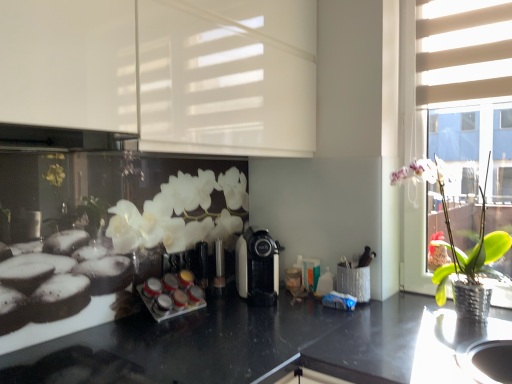
Question: Considering the relative sizes of green leafy plant in metallic pot at right and white glossy cabinet at upper left, acting as the first shutter starting from the left, in the image provided, is green leafy plant in metallic pot at right wider than white glossy cabinet at upper left, acting as the first shutter starting from the left,?

Choices:
 (A) no
 (B) yes

Answer: (A)

Question: Is green leafy plant in metallic pot at right behind white glossy cabinet at upper left, acting as the first shutter starting from the left?

Choices:
 (A) yes
 (B) no

Answer: (A)

Question: From a real-world perspective, is green leafy plant in metallic pot at right on white glossy cabinet at upper left, acting as the first shutter starting from the left?

Choices:
 (A) no
 (B) yes

Answer: (A)

Question: Is green leafy plant in metallic pot at right at the left side of white glossy cabinet at upper left, positioned as the second shutter in right-to-left order?

Choices:
 (A) no
 (B) yes

Answer: (A)

Question: Considering the relative sizes of green leafy plant in metallic pot at right and white glossy cabinet at upper left, acting as the first shutter starting from the left, in the image provided, is green leafy plant in metallic pot at right shorter than white glossy cabinet at upper left, acting as the first shutter starting from the left,?

Choices:
 (A) no
 (B) yes

Answer: (B)

Question: Looking at their shapes, would you say white glossy spice rack at center is wider or thinner than beige fabric blinds at upper right, which is the 2th shutter from left to right?

Choices:
 (A) thin
 (B) wide

Answer: (B)

Question: From their relative heights in the image, would you say white glossy spice rack at center is taller or shorter than beige fabric blinds at upper right, the 1th shutter positioned from the right?

Choices:
 (A) short
 (B) tall

Answer: (A)

Question: From the image's perspective, is white glossy spice rack at center above or below beige fabric blinds at upper right, which is the 2th shutter from left to right?

Choices:
 (A) below
 (B) above

Answer: (A)

Question: Considering their positions, is white glossy spice rack at center located in front of or behind beige fabric blinds at upper right, the 1th shutter positioned from the right?

Choices:
 (A) behind
 (B) front

Answer: (B)

Question: Is black plastic coffee machine at center bigger or smaller than beige fabric blinds at upper right, which is the 2th shutter from left to right?

Choices:
 (A) small
 (B) big

Answer: (B)

Question: From the image's perspective, relative to beige fabric blinds at upper right, the 1th shutter positioned from the right, is black plastic coffee machine at center above or below?

Choices:
 (A) below
 (B) above

Answer: (A)

Question: Is black plastic coffee machine at center wider or thinner than beige fabric blinds at upper right, which is the 2th shutter from left to right?

Choices:
 (A) wide
 (B) thin

Answer: (A)

Question: Is black plastic coffee machine at center in front of or behind beige fabric blinds at upper right, which is the 2th shutter from left to right, in the image?

Choices:
 (A) front
 (B) behind

Answer: (B)

Question: From the image's perspective, is green leafy plant in metallic pot at right above or below beige fabric blinds at upper right, which is the 2th shutter from left to right?

Choices:
 (A) below
 (B) above

Answer: (A)

Question: Would you say green leafy plant in metallic pot at right is inside or outside beige fabric blinds at upper right, which is the 2th shutter from left to right?

Choices:
 (A) inside
 (B) outside

Answer: (B)